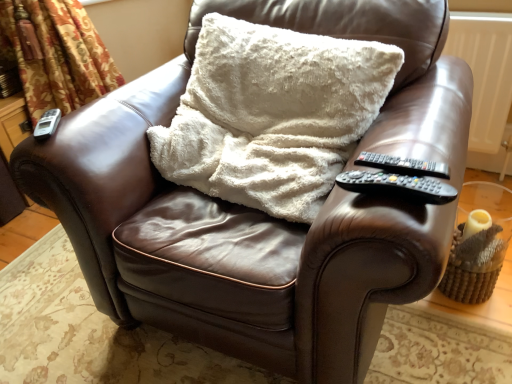
Locate an element on the screen. The image size is (512, 384). floral fabric curtain at left is located at coordinates (57, 54).

Locate an element on the screen. This screenshot has height=384, width=512. black plastic remote at right armrest, placed as the third remote when sorted from top to bottom is located at coordinates (397, 185).

Looking at this image, can you confirm if floral fabric curtain at left is bigger than white fluffy pillow at center?

Indeed, floral fabric curtain at left has a larger size compared to white fluffy pillow at center.

Is white fluffy pillow at center a part of floral fabric curtain at left?

No, white fluffy pillow at center is located outside of floral fabric curtain at left.

Which of these two, floral fabric curtain at left or white fluffy pillow at center, is wider?

Wider between the two is white fluffy pillow at center.

Could you tell me if floral fabric curtain at left is turned towards white fluffy pillow at center?

No, floral fabric curtain at left is not turned towards white fluffy pillow at center.

Looking at this image, from a real-world perspective, which object stands above the other?

silver metallic remote at upper left, the third remote when ordered from front to back.

Is white fluffy pillow at center to the left of silver metallic remote at upper left, placed as the first remote when sorted from back to front, from the viewer's perspective?

Incorrect, white fluffy pillow at center is not on the left side of silver metallic remote at upper left, placed as the first remote when sorted from back to front.

Considering the sizes of white fluffy pillow at center and silver metallic remote at upper left, which is the 3th remote from bottom to top, in the image, is white fluffy pillow at center bigger or smaller than silver metallic remote at upper left, which is the 3th remote from bottom to top,?

white fluffy pillow at center is bigger than silver metallic remote at upper left, which is the 3th remote from bottom to top.

Are floral fabric curtain at left and black plastic remote at right, which is the second remote in front-to-back order, far apart?

Absolutely, floral fabric curtain at left is distant from black plastic remote at right, which is the second remote in front-to-back order.

Who is bigger, floral fabric curtain at left or black plastic remote at right, which is the second remote in front-to-back order?

floral fabric curtain at left.

Considering the positions of point (21, 8) and point (374, 162), is point (21, 8) closer or farther from the camera than point (374, 162)?

Point (21, 8) appears to be farther away from the viewer than point (374, 162).

Could you tell me if floral fabric curtain at left is turned towards black plastic remote at right, the second remote when ordered from top to bottom?

No, floral fabric curtain at left is not aimed at black plastic remote at right, the second remote when ordered from top to bottom.

Looking at this image, considering their positions, is silver metallic remote at upper left, acting as the first remote starting from the left, located in front of or behind white fluffy pillow at center?

silver metallic remote at upper left, acting as the first remote starting from the left, is behind white fluffy pillow at center.

Is silver metallic remote at upper left, the third remote when ordered from front to back, next to white fluffy pillow at center and touching it?

silver metallic remote at upper left, the third remote when ordered from front to back, and white fluffy pillow at center are clearly separated.

Consider the image. What's the angular difference between silver metallic remote at upper left, the third remote when ordered from front to back, and white fluffy pillow at center's facing directions?

silver metallic remote at upper left, the third remote when ordered from front to back, and white fluffy pillow at center are facing 42.7 degrees away from each other.

From a real-world perspective, is silver metallic remote at upper left, acting as the third remote starting from the right, on white fluffy pillow at center?

Indeed, from a real-world perspective, silver metallic remote at upper left, acting as the third remote starting from the right, stands above white fluffy pillow at center.

Is black plastic remote at right armrest, the 1th remote positioned from the bottom, oriented towards silver metallic remote at upper left, the 1th remote in the top-to-bottom sequence?

No, black plastic remote at right armrest, the 1th remote positioned from the bottom, is not aimed at silver metallic remote at upper left, the 1th remote in the top-to-bottom sequence.

In the scene shown: Is black plastic remote at right armrest, positioned as the second remote in right-to-left order, wider or thinner than silver metallic remote at upper left, the 1th remote in the top-to-bottom sequence?

In the image, black plastic remote at right armrest, positioned as the second remote in right-to-left order, appears to be more narrow than silver metallic remote at upper left, the 1th remote in the top-to-bottom sequence.

Does black plastic remote at right armrest, placed as the third remote when sorted from top to bottom, have a smaller size compared to silver metallic remote at upper left, acting as the first remote starting from the left?

Actually, black plastic remote at right armrest, placed as the third remote when sorted from top to bottom, might be larger than silver metallic remote at upper left, acting as the first remote starting from the left.

From a real-world perspective, which is physically above, floral fabric curtain at left or silver metallic remote at upper left, acting as the first remote starting from the left?

silver metallic remote at upper left, acting as the first remote starting from the left, is physically above.

Between floral fabric curtain at left and silver metallic remote at upper left, the 1th remote in the top-to-bottom sequence, which one has more height?

floral fabric curtain at left.

Does floral fabric curtain at left have a larger size compared to silver metallic remote at upper left, acting as the first remote starting from the left?

Yes.

Find the location of a particular element. Image resolution: width=512 pixels, height=384 pixels. remote that is the 1st one when counting forward from the floral fabric curtain at left is located at coordinates (47, 124).

How many degrees apart are the facing directions of silver metallic remote at upper left, which is the 3th remote from bottom to top, and black plastic remote at right armrest, the 1th remote positioned from the bottom?

The angle between the facing direction of silver metallic remote at upper left, which is the 3th remote from bottom to top, and the facing direction of black plastic remote at right armrest, the 1th remote positioned from the bottom, is 33.5 degrees.

Which of these two, silver metallic remote at upper left, acting as the first remote starting from the left, or black plastic remote at right armrest, the 1th remote positioned from the bottom, is bigger?

Bigger between the two is black plastic remote at right armrest, the 1th remote positioned from the bottom.

Between silver metallic remote at upper left, placed as the first remote when sorted from back to front, and black plastic remote at right armrest, marked as the 2th remote in a left-to-right arrangement, which one is positioned behind?

silver metallic remote at upper left, placed as the first remote when sorted from back to front, is further away from the camera.

Which of these two, silver metallic remote at upper left, which is the 3th remote from bottom to top, or black plastic remote at right armrest, which is the third remote from back to front, is thinner?

Thinner between the two is black plastic remote at right armrest, which is the third remote from back to front.

This screenshot has width=512, height=384. What are the coordinates of `pillow located on the right of floral fabric curtain at left` in the screenshot? It's located at point(272,114).

You are a GUI agent. You are given a task and a screenshot of the screen. Output one action in this format:
    pyautogui.click(x=<x>, y=<y>)
    Task: Click on the remote on the left of white fluffy pillow at center
    This screenshot has width=512, height=384.
    Given the screenshot: What is the action you would take?
    pyautogui.click(x=47, y=124)

Based on their spatial positions, is black plastic remote at right, positioned as the first remote in right-to-left order, or silver metallic remote at upper left, which is the 3th remote from bottom to top, further from white fluffy pillow at center?

silver metallic remote at upper left, which is the 3th remote from bottom to top.

Which object lies nearer to the anchor point silver metallic remote at upper left, the third remote when ordered from front to back, white fluffy pillow at center or floral fabric curtain at left?

white fluffy pillow at center is closer to silver metallic remote at upper left, the third remote when ordered from front to back.

Considering their positions, is silver metallic remote at upper left, the 1th remote in the top-to-bottom sequence, positioned closer to white fluffy pillow at center than black plastic remote at right, the second remote when ordered from top to bottom?

black plastic remote at right, the second remote when ordered from top to bottom.

Estimate the real-world distances between objects in this image. Which object is further from black plastic remote at right, the second remote when ordered from top to bottom, floral fabric curtain at left or white fluffy pillow at center?

floral fabric curtain at left.

From the image, which object appears to be nearer to white fluffy pillow at center, black plastic remote at right armrest, which is the third remote from back to front, or silver metallic remote at upper left, placed as the first remote when sorted from back to front?

Based on the image, black plastic remote at right armrest, which is the third remote from back to front, appears to be nearer to white fluffy pillow at center.

When comparing their distances from black plastic remote at right, marked as the 2th remote in a back-to-front arrangement, does white fluffy pillow at center or black plastic remote at right armrest, marked as the 2th remote in a left-to-right arrangement, seem further?

white fluffy pillow at center.

Which object lies further to the anchor point black plastic remote at right, which is the second remote in front-to-back order, black plastic remote at right armrest, marked as the 2th remote in a left-to-right arrangement, or white fluffy pillow at center?

Based on the image, white fluffy pillow at center appears to be further to black plastic remote at right, which is the second remote in front-to-back order.

Considering their positions, is silver metallic remote at upper left, the 1th remote in the top-to-bottom sequence, positioned further to floral fabric curtain at left than black plastic remote at right armrest, marked as the 2th remote in a left-to-right arrangement?

Based on the image, black plastic remote at right armrest, marked as the 2th remote in a left-to-right arrangement, appears to be further to floral fabric curtain at left.

You are a GUI agent. You are given a task and a screenshot of the screen. Output one action in this format:
    pyautogui.click(x=<x>, y=<y>)
    Task: Click on the remote between white fluffy pillow at center and black plastic remote at right, which is the second remote in front-to-back order, in the horizontal direction
    The image size is (512, 384).
    Given the screenshot: What is the action you would take?
    pyautogui.click(x=397, y=185)

You are a GUI agent. You are given a task and a screenshot of the screen. Output one action in this format:
    pyautogui.click(x=<x>, y=<y>)
    Task: Click on the remote located between silver metallic remote at upper left, placed as the first remote when sorted from back to front, and black plastic remote at right, which is the second remote in front-to-back order, in the left-right direction
    The height and width of the screenshot is (384, 512).
    Given the screenshot: What is the action you would take?
    pyautogui.click(x=397, y=185)

Identify the location of pillow located between silver metallic remote at upper left, the third remote when ordered from front to back, and black plastic remote at right, the 3th remote viewed from the left, in the left-right direction. This screenshot has width=512, height=384. (272, 114).

Locate an element on the screen. The image size is (512, 384). pillow situated between silver metallic remote at upper left, placed as the first remote when sorted from back to front, and black plastic remote at right armrest, positioned as the second remote in right-to-left order, from left to right is located at coordinates (272, 114).